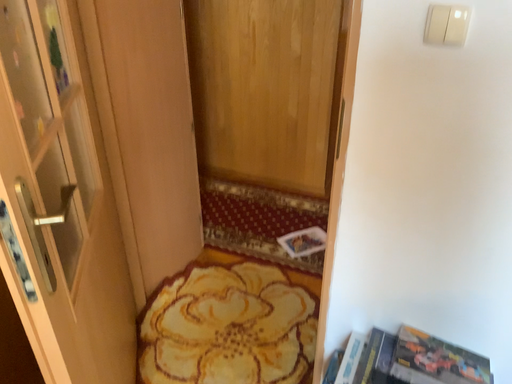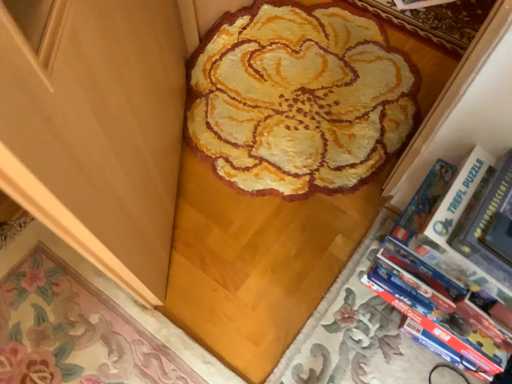
Question: Which way did the camera rotate in the video?

Choices:
 (A) rotated left
 (B) rotated right

Answer: (A)